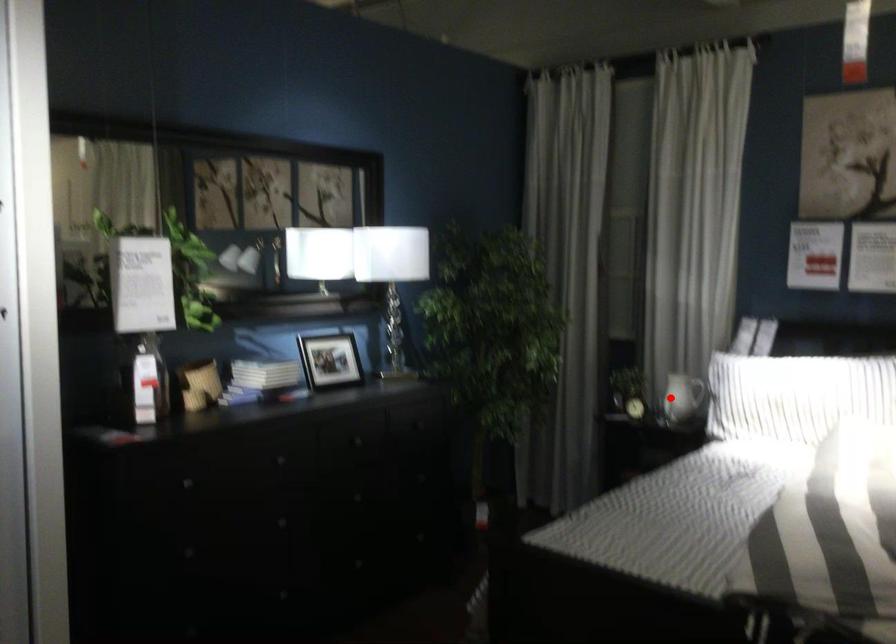
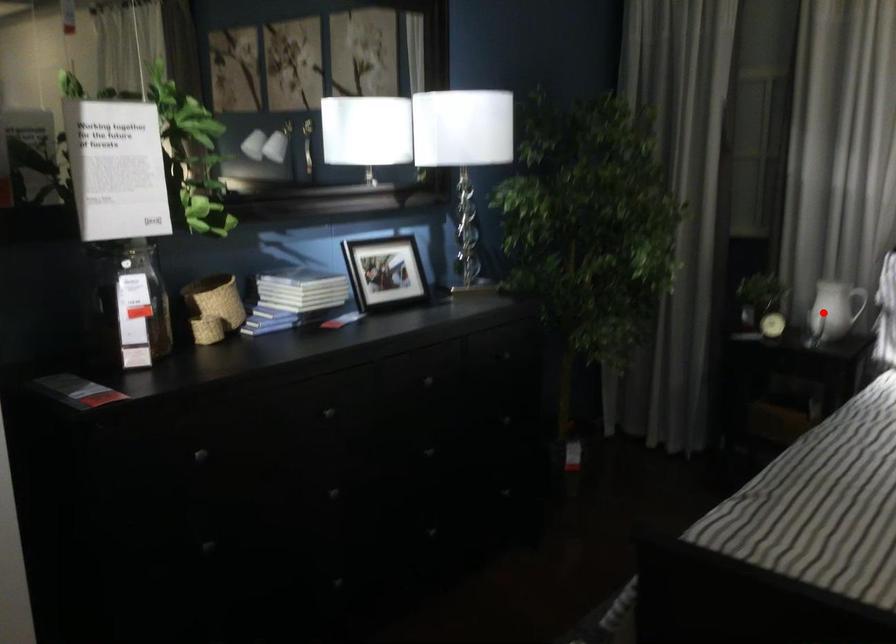
I am providing you with two images of the same scene from different viewpoints. A red point is marked on the first image and another point is marked on the second image. Is the marked point in image1 the same physical position as the marked point in image2?

Yes